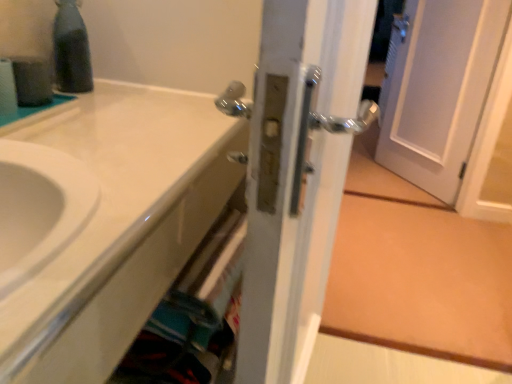
Question: From a real-world perspective, is satin nickel door handle at center beneath black glass bottle at upper left?

Choices:
 (A) yes
 (B) no

Answer: (A)

Question: Can you confirm if satin nickel door handle at center is positioned to the left of black glass bottle at upper left?

Choices:
 (A) no
 (B) yes

Answer: (A)

Question: Considering the relative sizes of satin nickel door handle at center and black glass bottle at upper left in the image provided, is satin nickel door handle at center smaller than black glass bottle at upper left?

Choices:
 (A) yes
 (B) no

Answer: (B)

Question: Considering the relative sizes of satin nickel door handle at center and black glass bottle at upper left in the image provided, is satin nickel door handle at center taller than black glass bottle at upper left?

Choices:
 (A) yes
 (B) no

Answer: (A)

Question: Is the position of satin nickel door handle at center less distant than that of black glass bottle at upper left?

Choices:
 (A) yes
 (B) no

Answer: (A)

Question: Is satin nickel door handle at center positioned with its back to black glass bottle at upper left?

Choices:
 (A) yes
 (B) no

Answer: (A)

Question: Is white glossy sink at lower left wider than satin nickel door handle at center?

Choices:
 (A) yes
 (B) no

Answer: (A)

Question: Does white glossy sink at lower left appear on the right side of satin nickel door handle at center?

Choices:
 (A) no
 (B) yes

Answer: (A)

Question: Does white glossy sink at lower left have a lesser height compared to satin nickel door handle at center?

Choices:
 (A) yes
 (B) no

Answer: (A)

Question: Does white glossy sink at lower left have a larger size compared to satin nickel door handle at center?

Choices:
 (A) no
 (B) yes

Answer: (A)

Question: Would you consider white glossy sink at lower left to be distant from satin nickel door handle at center?

Choices:
 (A) no
 (B) yes

Answer: (A)

Question: Is white glossy sink at lower left thinner than satin nickel door handle at center?

Choices:
 (A) no
 (B) yes

Answer: (A)

Question: Considering the relative sizes of black glass bottle at upper left and white glossy sink at lower left in the image provided, is black glass bottle at upper left smaller than white glossy sink at lower left?

Choices:
 (A) no
 (B) yes

Answer: (B)